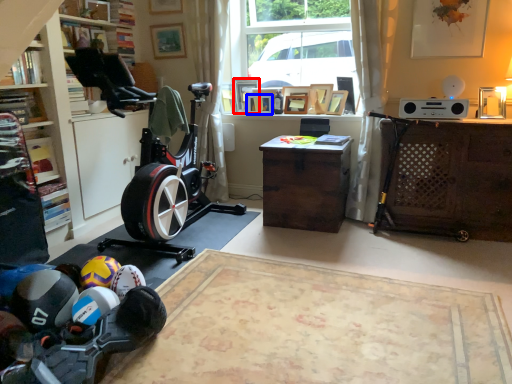
Question: Which object is closer to the camera taking this photo, picture frame (highlighted by a red box) or picture frame (highlighted by a blue box)?

Choices:
 (A) picture frame
 (B) picture frame

Answer: (B)